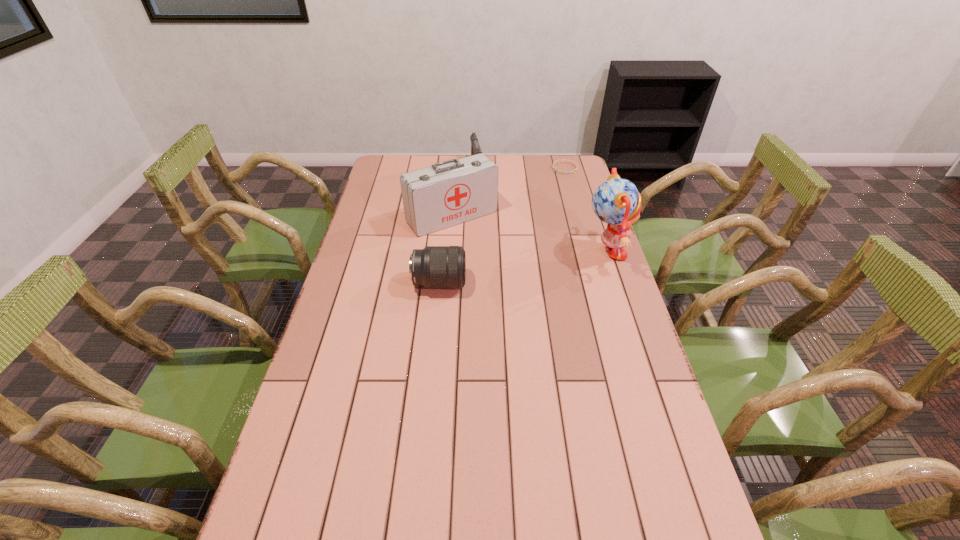
Where is `vacant spot on the desktop that is between the telephoto lens and the doll and is positioned on the front-facing side of the second tallest object`? Image resolution: width=960 pixels, height=540 pixels. vacant spot on the desktop that is between the telephoto lens and the doll and is positioned on the front-facing side of the second tallest object is located at coordinates (501, 272).

Locate an element on the screen. This screenshot has width=960, height=540. vacant space on the desktop that is between the telephoto lens and the tallest object and is positioned in the direction the gun is aimed is located at coordinates (507, 271).

You are a GUI agent. You are given a task and a screenshot of the screen. Output one action in this format:
    pyautogui.click(x=<x>, y=<y>)
    Task: Click on the free space on the desktop that is between the telephoto lens and the doll and is positioned on the surface of the bracelet showing star-shaped elements
    The height and width of the screenshot is (540, 960).
    Given the screenshot: What is the action you would take?
    pyautogui.click(x=529, y=267)